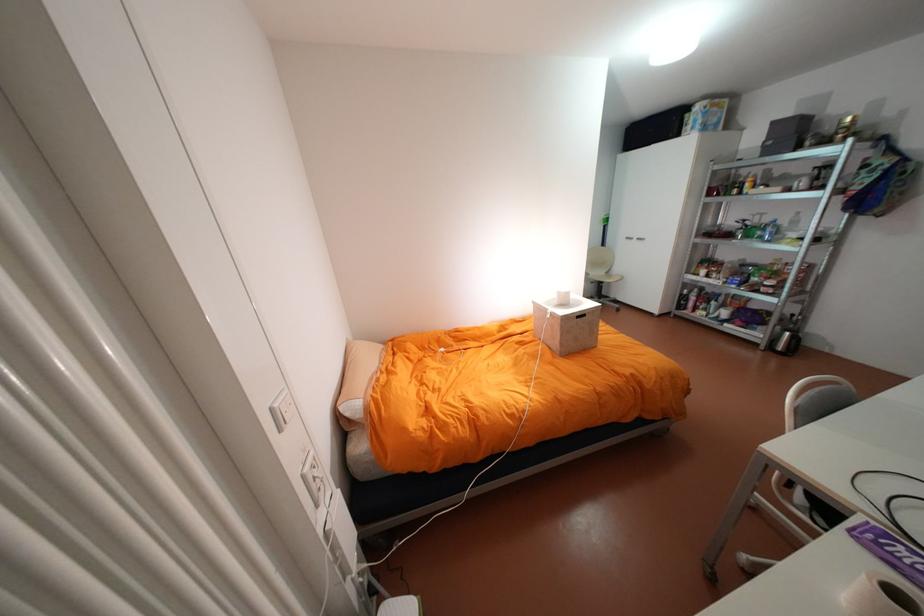
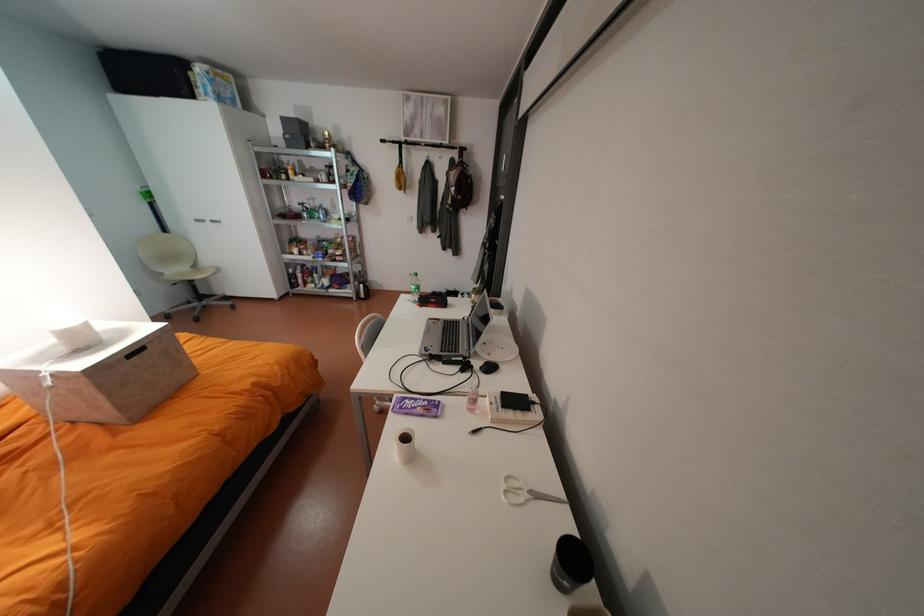
Based on the continuous images, in which direction is the camera rotating?

The camera's rotation is toward right-down.